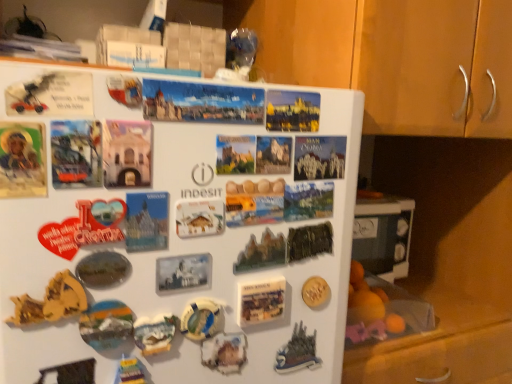
This screenshot has width=512, height=384. Find the location of `shiny metallic globe at center, the 5th art in the left-to-right sequence`. shiny metallic globe at center, the 5th art in the left-to-right sequence is located at coordinates click(202, 319).

This screenshot has height=384, width=512. What do you see at coordinates (261, 301) in the screenshot?
I see `matte plastic postcard at center, the first postcard positioned from the bottom` at bounding box center [261, 301].

The height and width of the screenshot is (384, 512). Describe the element at coordinates (319, 157) in the screenshot. I see `matte paper postcard at upper right, placed as the third postcard when sorted from bottom to top` at that location.

Describe the element at coordinates (103, 269) in the screenshot. I see `metallic mirror at center, positioned as the 9th art in right-to-left order` at that location.

You are a GUI agent. You are given a task and a screenshot of the screen. Output one action in this format:
    pyautogui.click(x=<x>, y=<y>)
    Task: Click on the metallic silver castle at lower right, which appears as the 3th art when viewed from the right
    Image resolution: width=512 pixels, height=384 pixels.
    Given the screenshot: What is the action you would take?
    pyautogui.click(x=297, y=352)

Considering the positions of points (148, 218) and (262, 290), is point (148, 218) closer to camera compared to point (262, 290)?

That is True.

Which object is more forward, matte paper postcard at center, the 2th postcard when ordered from bottom to top, or matte plastic postcard at center, which ranks as the fourth postcard in top-to-bottom order?

matte paper postcard at center, the 2th postcard when ordered from bottom to top.

From the image's perspective, who appears lower, matte paper postcard at center, the 3th postcard when ordered from top to bottom, or matte plastic postcard at center, which ranks as the fourth postcard in top-to-bottom order?

matte plastic postcard at center, which ranks as the fourth postcard in top-to-bottom order.

Can you confirm if matte paper postcard at center, the 3th postcard when ordered from top to bottom, is positioned to the right of matte plastic postcard at center, the first postcard positioned from the bottom?

No.

Does metallic mirror at center, positioned as the 9th art in right-to-left order, have a greater width compared to crinkled paper at lower left, the first art when ordered from left to right?

Yes, metallic mirror at center, positioned as the 9th art in right-to-left order, is wider than crinkled paper at lower left, the first art when ordered from left to right.

Can you confirm if metallic mirror at center, the second art when ordered from left to right, is smaller than crinkled paper at lower left, the first art when ordered from left to right?

Indeed, metallic mirror at center, the second art when ordered from left to right, has a smaller size compared to crinkled paper at lower left, the first art when ordered from left to right.

Would you consider metallic mirror at center, the second art when ordered from left to right, to be distant from crinkled paper at lower left, arranged as the 10th art when viewed from the right?

metallic mirror at center, the second art when ordered from left to right, is near crinkled paper at lower left, arranged as the 10th art when viewed from the right, not far away.

Which is correct: matte plastic magnet at center, acting as the 6th art starting from the left, is inside metallic mirror at center, the second art when ordered from left to right, or outside of it?

The correct answer is: outside.

Which object is positioned more to the left, matte plastic magnet at center, acting as the 6th art starting from the left, or metallic mirror at center, the second art when ordered from left to right?

metallic mirror at center, the second art when ordered from left to right, is more to the left.

Can you confirm if matte plastic magnet at center, acting as the 6th art starting from the left, is wider than metallic mirror at center, positioned as the 9th art in right-to-left order?

In fact, matte plastic magnet at center, acting as the 6th art starting from the left, might be narrower than metallic mirror at center, positioned as the 9th art in right-to-left order.

Which is in front, point (232, 337) or point (97, 283)?

Positioned in front is point (97, 283).

From the image's perspective, which is above, matte plastic magnet at lower center, which is the 7th art in right-to-left order, or matte paper postcard at upper right, which is the 2th postcard from top to bottom?

matte paper postcard at upper right, which is the 2th postcard from top to bottom.

Is matte plastic magnet at lower center, the 4th art positioned from the left, touching matte paper postcard at upper right, placed as the third postcard when sorted from bottom to top?

No, matte plastic magnet at lower center, the 4th art positioned from the left, is not touching matte paper postcard at upper right, placed as the third postcard when sorted from bottom to top.

From a real-world perspective, does matte plastic magnet at lower center, the 4th art positioned from the left, stand above matte paper postcard at upper right, placed as the third postcard when sorted from bottom to top?

No, from a real-world perspective, matte plastic magnet at lower center, the 4th art positioned from the left, is not above matte paper postcard at upper right, placed as the third postcard when sorted from bottom to top.

Considering the relative positions of matte plastic magnet at lower center, which is the 7th art in right-to-left order, and matte paper postcard at upper right, placed as the third postcard when sorted from bottom to top, in the image provided, is matte plastic magnet at lower center, which is the 7th art in right-to-left order, to the left or to the right of matte paper postcard at upper right, placed as the third postcard when sorted from bottom to top,?

matte plastic magnet at lower center, which is the 7th art in right-to-left order, is to the left of matte paper postcard at upper right, placed as the third postcard when sorted from bottom to top.

From a real-world perspective, which is physically above, shiny metallic globe at center, which is counted as the sixth art, starting from the right, or metallic silver magnet at lower left, which is the 3th art from left to right?

metallic silver magnet at lower left, which is the 3th art from left to right, is physically above.

Does point (193, 302) appear closer or farther from the camera than point (106, 324)?

Clearly, point (193, 302) is more distant from the camera than point (106, 324).

How many degrees apart are the facing directions of shiny metallic globe at center, which is counted as the sixth art, starting from the right, and metallic silver magnet at lower left, the eighth art viewed from the right?

3.08 degrees.

Considering their positions, is shiny metallic globe at center, which is counted as the sixth art, starting from the right, located in front of or behind metallic silver magnet at lower left, the eighth art viewed from the right?

Visually, shiny metallic globe at center, which is counted as the sixth art, starting from the right, is located behind metallic silver magnet at lower left, the eighth art viewed from the right.

From the image's perspective, is shiny metallic globe at center, which is counted as the sixth art, starting from the right, on metallic silver castle at lower right, which appears as the 3th art when viewed from the right?

Yes.

Which object is closer to the camera taking this photo, shiny metallic globe at center, the 5th art in the left-to-right sequence, or metallic silver castle at lower right, which appears as the 3th art when viewed from the right?

shiny metallic globe at center, the 5th art in the left-to-right sequence, is closer to the camera.

Between shiny metallic globe at center, the 5th art in the left-to-right sequence, and metallic silver castle at lower right, the eighth art in the left-to-right sequence, which one has smaller size?

With smaller size is shiny metallic globe at center, the 5th art in the left-to-right sequence.

Looking at the image, does metallic silver magnet at lower left, the eighth art viewed from the right, seem bigger or smaller compared to metallic gold leaf at upper right, which appears as the second art when viewed from the right?

In the image, metallic silver magnet at lower left, the eighth art viewed from the right, appears to be smaller than metallic gold leaf at upper right, which appears as the second art when viewed from the right.

Would you say metallic silver magnet at lower left, the eighth art viewed from the right, is outside metallic gold leaf at upper right, which appears as the second art when viewed from the right?

Yes, metallic silver magnet at lower left, the eighth art viewed from the right, is not within metallic gold leaf at upper right, which appears as the second art when viewed from the right.

Can you confirm if metallic silver magnet at lower left, which is the 3th art from left to right, is positioned to the right of metallic gold leaf at upper right, arranged as the ninth art when viewed from the left?

No, metallic silver magnet at lower left, which is the 3th art from left to right, is not to the right of metallic gold leaf at upper right, arranged as the ninth art when viewed from the left.

Image resolution: width=512 pixels, height=384 pixels. What are the coordinates of `the 2nd postcard to the left of the matte plastic postcard at center, the first postcard positioned from the bottom, counting from the anchor's position` in the screenshot? It's located at (146, 221).

Image resolution: width=512 pixels, height=384 pixels. In order to click on art located in front of the metallic mirror at center, positioned as the 9th art in right-to-left order in this screenshot , I will do `click(51, 301)`.

From the image, which object appears to be farther from metallic mirror at center, the second art when ordered from left to right, matte plastic postcard at center, which ranks as the fourth postcard in top-to-bottom order, or matte paper postcard at upper right, which is the 2th postcard from top to bottom?

matte paper postcard at upper right, which is the 2th postcard from top to bottom, is further to metallic mirror at center, the second art when ordered from left to right.

From the picture: Based on their spatial positions, is matte plastic magnet at center, which is counted as the 5th art, starting from the right, or shiny metallic globe at center, which is counted as the sixth art, starting from the right, further from metallic silver magnet at lower left, the eighth art viewed from the right?

matte plastic magnet at center, which is counted as the 5th art, starting from the right, lies further to metallic silver magnet at lower left, the eighth art viewed from the right, than the other object.

Consider the image. Based on their spatial positions, is metallic gold leaf at upper right, arranged as the ninth art when viewed from the left, or matte plastic magnet at center, acting as the 6th art starting from the left, further from metallic silver castle at lower right, which appears as the 3th art when viewed from the right?

Based on the image, metallic gold leaf at upper right, arranged as the ninth art when viewed from the left, appears to be further to metallic silver castle at lower right, which appears as the 3th art when viewed from the right.

From the image, which object appears to be farther from metallic gold leaf at upper right, which appears as the second art when viewed from the right, shiny metallic globe at center, which is counted as the sixth art, starting from the right, or matte plastic postcard at center, the first postcard positioned from the bottom?

shiny metallic globe at center, which is counted as the sixth art, starting from the right, is further to metallic gold leaf at upper right, which appears as the second art when viewed from the right.

Consider the image. From the image, which object appears to be farther from shiny metallic globe at center, the 5th art in the left-to-right sequence, wooden cabinet at upper right or matte paper postcard at upper right, which is the 2th postcard from top to bottom?

wooden cabinet at upper right is positioned further to the anchor shiny metallic globe at center, the 5th art in the left-to-right sequence.

Looking at this image, from the image, which object appears to be farther from green matte magnet at center, placed as the 4th art when sorted from right to left, matte paper postcard at center, the 2th postcard when ordered from bottom to top, or matte plastic magnet at center, which is counted as the 5th art, starting from the right?

The object further to green matte magnet at center, placed as the 4th art when sorted from right to left, is matte paper postcard at center, the 2th postcard when ordered from bottom to top.

From the image, which object appears to be farther from wooden cabinet at upper right, crinkled paper at lower left, arranged as the 10th art when viewed from the right, or green matte magnet at center, placed as the 4th art when sorted from right to left?

crinkled paper at lower left, arranged as the 10th art when viewed from the right, is positioned further to the anchor wooden cabinet at upper right.

Considering their positions, is matte paper postcard at center, the 2th postcard when ordered from bottom to top, positioned further to metallic silver castle at lower right, which appears as the 3th art when viewed from the right, than metallic silver magnet at lower left, which is the 3th art from left to right?

The object further to metallic silver castle at lower right, which appears as the 3th art when viewed from the right, is matte paper postcard at center, the 2th postcard when ordered from bottom to top.

Where is `art located between matte plastic magnet at lower center, the 4th art positioned from the left, and matte plastic magnet at center, which is counted as the 5th art, starting from the right, in the left-right direction`? This screenshot has width=512, height=384. art located between matte plastic magnet at lower center, the 4th art positioned from the left, and matte plastic magnet at center, which is counted as the 5th art, starting from the right, in the left-right direction is located at coordinates (202, 319).

Where is `postcard between green matte magnet at center, arranged as the 7th art when viewed from the left, and matte plastic magnet at center, acting as the 6th art starting from the left, from top to bottom`? postcard between green matte magnet at center, arranged as the 7th art when viewed from the left, and matte plastic magnet at center, acting as the 6th art starting from the left, from top to bottom is located at coordinates (261, 301).

At what (x,y) coordinates should I click in order to perform the action: click on postcard between green matte magnet at center, arranged as the 7th art when viewed from the left, and metallic silver castle at lower right, the eighth art in the left-to-right sequence, in the up-down direction. Please return your answer as a coordinate pair (x, y). This screenshot has height=384, width=512. Looking at the image, I should click on (261, 301).

The height and width of the screenshot is (384, 512). Find the location of `postcard situated between matte plastic magnet at center, which is counted as the 5th art, starting from the right, and metallic silver castle at lower right, the eighth art in the left-to-right sequence, from left to right`. postcard situated between matte plastic magnet at center, which is counted as the 5th art, starting from the right, and metallic silver castle at lower right, the eighth art in the left-to-right sequence, from left to right is located at coordinates (261, 301).